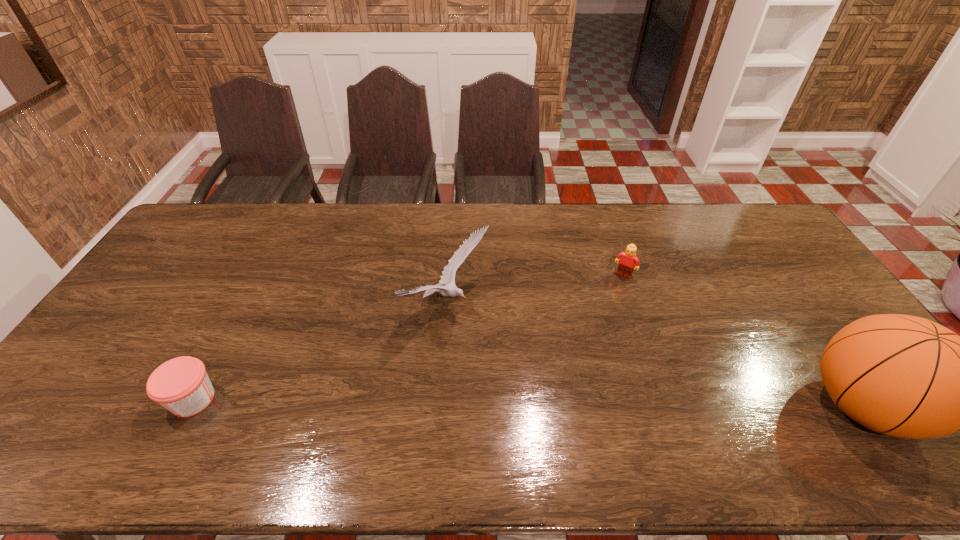
At what (x,y) coordinates should I click in order to perform the action: click on object that is positioned at the right edge. Please return your answer as a coordinate pair (x, y). Looking at the image, I should click on (905, 376).

The width and height of the screenshot is (960, 540). What are the coordinates of `object situated at the near right corner` in the screenshot? It's located at (905, 376).

The width and height of the screenshot is (960, 540). In order to click on free spot at the far edge of the desktop in this screenshot , I will do `click(416, 241)`.

The width and height of the screenshot is (960, 540). In the image, there is a desktop. Identify the location of vacant space at the near edge. (664, 423).

The image size is (960, 540). Find the location of `vacant space at the left edge of the desktop`. vacant space at the left edge of the desktop is located at coordinates (156, 269).

This screenshot has width=960, height=540. In order to click on vacant area that lies between the third object from left to right and the jam in this screenshot , I will do `click(408, 337)`.

Locate an element on the screen. The height and width of the screenshot is (540, 960). unoccupied area between the tallest object and the shortest object is located at coordinates (527, 403).

Where is `free space between the third object from left to right and the basketball`? The width and height of the screenshot is (960, 540). free space between the third object from left to right and the basketball is located at coordinates (743, 341).

Locate an element on the screen. This screenshot has width=960, height=540. free area in between the leftmost object and the third object from right to left is located at coordinates (321, 353).

Find the location of a particular element. vacant space that is in between the third shortest object and the rightmost object is located at coordinates (655, 356).